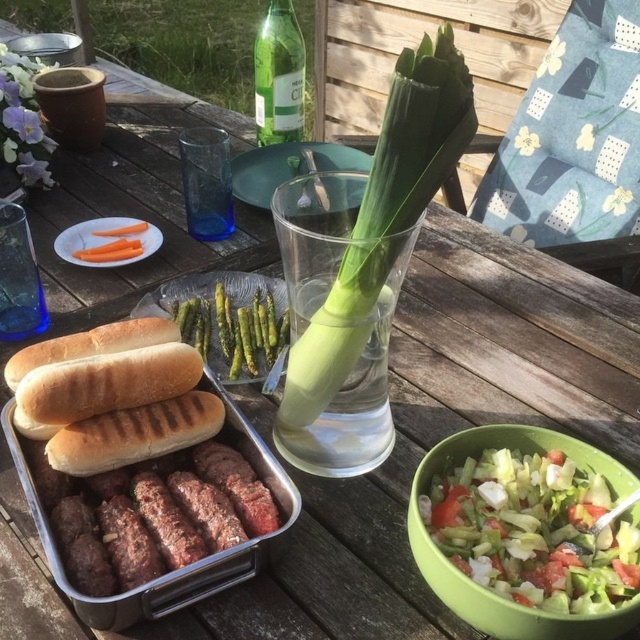
Does fresh green salad at lower right have a lesser height compared to transparent glass at center?

Correct, fresh green salad at lower right is not as tall as transparent glass at center.

Does fresh green salad at lower right have a greater width compared to transparent glass at center?

Incorrect, fresh green salad at lower right's width does not surpass transparent glass at center's.

The width and height of the screenshot is (640, 640). Find the location of `fresh green salad at lower right`. fresh green salad at lower right is located at coordinates (532, 529).

Is brown toasted bread at center to the right of orange matte carrots at center from the viewer's perspective?

Correct, you'll find brown toasted bread at center to the right of orange matte carrots at center.

Who is higher up, brown toasted bread at center or orange matte carrots at center?

orange matte carrots at center

Is point (195, 376) farther from camera compared to point (147, 243)?

No, it is in front of (147, 243).

You are a GUI agent. You are given a task and a screenshot of the screen. Output one action in this format:
    pyautogui.click(x=<x>, y=<y>)
    Task: Click on the brown toasted bread at center
    
    Given the screenshot: What is the action you would take?
    pyautogui.click(x=99, y=372)

Which is behind, point (499, 452) or point (99, 348)?

Positioned behind is point (99, 348).

What are the coordinates of `fresh green salad at lower right` in the screenshot? It's located at (532, 529).

Identify the location of fresh green salad at lower right. The height and width of the screenshot is (640, 640). (532, 529).